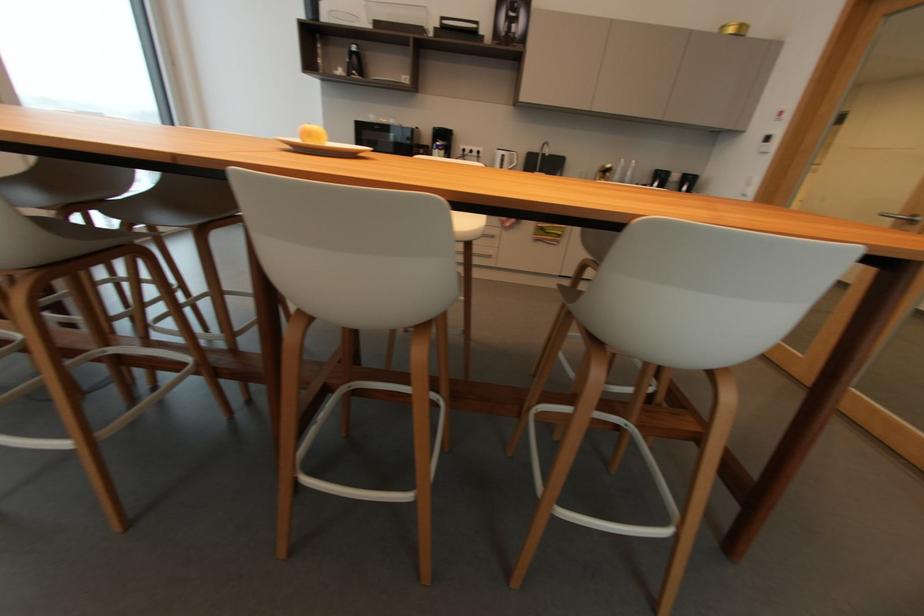
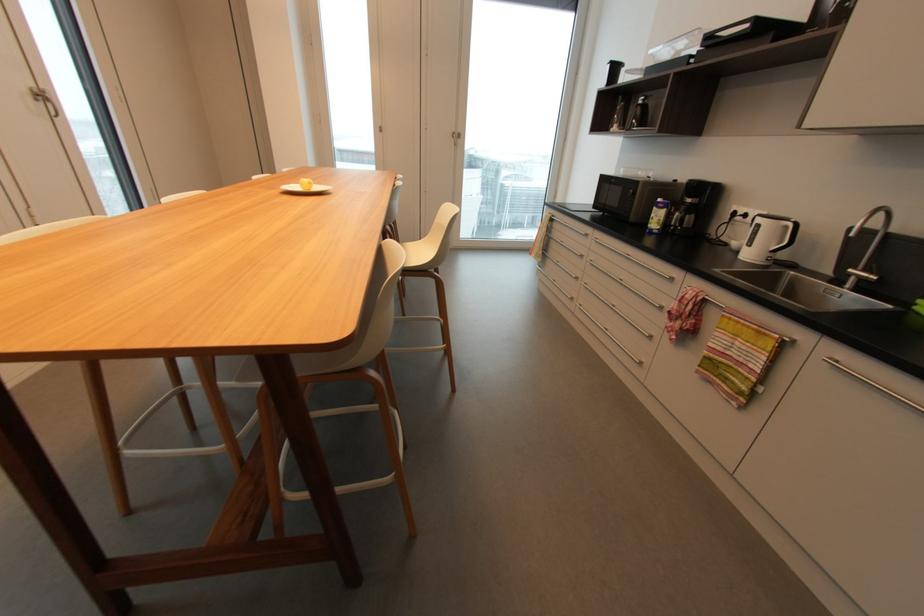
Locate, in the second image, the point that corresponds to pixel 441 144 in the first image.

(663, 200)